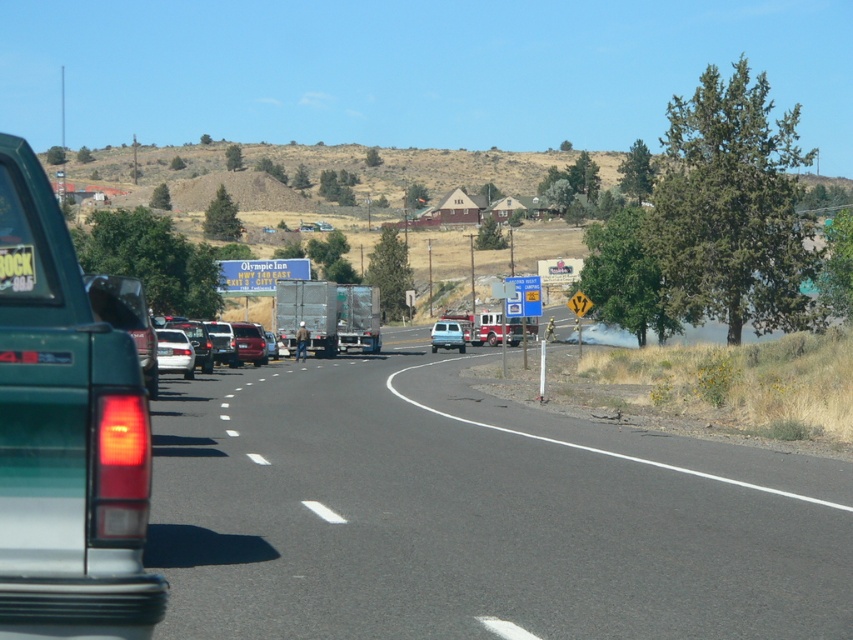
You are driving a white matte sedan at center on a black asphalt road at center. You want to make a quick lane change to avoid an obstacle. Considering the road and your car, do you think there is enough space to safely perform this maneuver?

The black asphalt road at center is wider than the white matte sedan at center, so there should be enough space to safely perform a lane change maneuver.

You are driving a car and see the green matte truck at left and white matte sedan at center ahead on the highway. If your car is 4 meters long, can you safely pass between them without cutting off either vehicle?

The distance between the green matte truck at left and white matte sedan at center is 17.86 meters. Since your car is only 4 meters long, there is sufficient space to safely pass between them without cutting off either vehicle.

You are a driver approaching the white matte sedan at center on the rural highway. The sedan is in your lane. Can you safely pass the sedan on the right side of the road without crossing the dashed white line?

The white matte sedan at center is located at point (x=173, y=353). Since the road has dashed white lines dividing the lanes, it is generally permissible to pass when the dashed lines are present, provided there is sufficient space and no oncoming traffic. However, the presence of a grassy area with trees on the right may not provide a safe passing lane. Check for obstructions and traffic before deciding to pass.